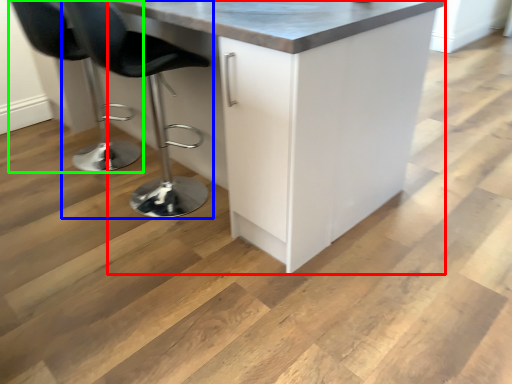
Question: Which object is the closest to the cabinetry (highlighted by a red box)? Choose among these: chair (highlighted by a blue box) or chair (highlighted by a green box).

Choices:
 (A) chair
 (B) chair

Answer: (A)